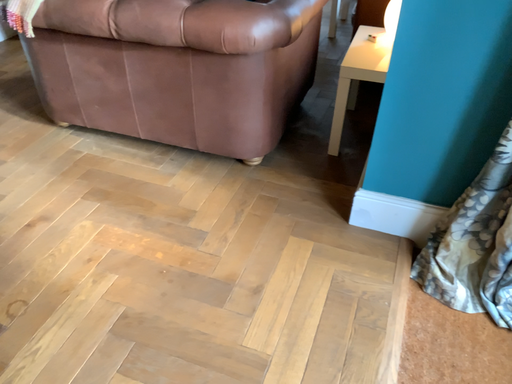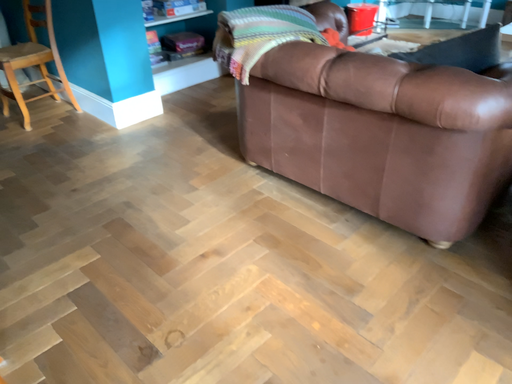
Question: Which way did the camera rotate in the video?

Choices:
 (A) rotated downward
 (B) rotated upward

Answer: (B)